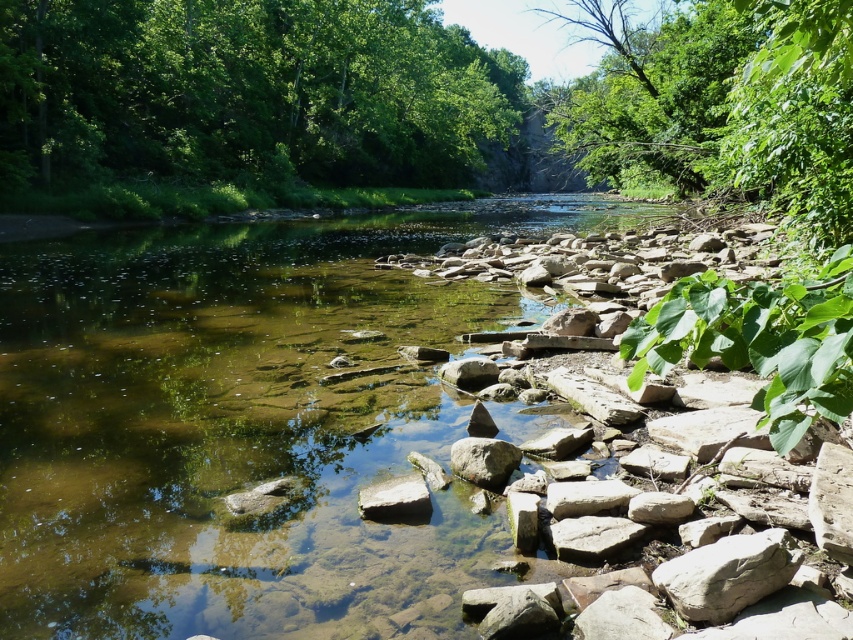
You are standing at the edge of the river and notice the green leafy trees at upper left and the smooth gray rock at center. Which object is positioned higher in the scene?

The green leafy trees at upper left are positioned higher in the scene than the smooth gray rock at center.

You are planning to plant a new tree between the green leafy trees at upper left and the rocky shoreline on the right side of the river. The new tree requires a minimum of 50 feet of space between it and the existing trees. Will there be enough space for the new tree?

The green leafy trees at upper left are 88.72 feet apart from each other. Since the new tree requires a minimum of 50 feet of space between it and the existing trees, planting it between them would provide sufficient space as 88.72 feet is greater than 50 feet.